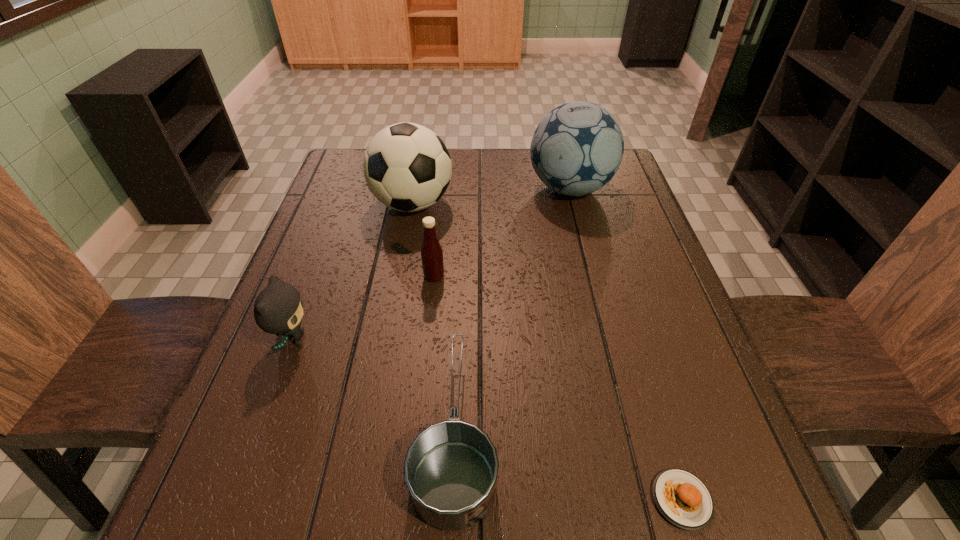
This screenshot has height=540, width=960. I want to click on vacant space at the far right corner of the desktop, so click(618, 185).

At what (x,y) coordinates should I click in order to perform the action: click on free space between the second shortest object and the Tabasco sauce. Please return your answer as a coordinate pair (x, y). Looking at the image, I should click on (444, 353).

The image size is (960, 540). I want to click on free spot between the leftmost object and the saucepan, so click(x=374, y=384).

Locate an element on the screen. The image size is (960, 540). free area in between the right soccer ball and the saucepan is located at coordinates (513, 309).

You are a GUI agent. You are given a task and a screenshot of the screen. Output one action in this format:
    pyautogui.click(x=<x>, y=<y>)
    Task: Click on the unoccupied position between the shortest object and the kitten
    This screenshot has height=540, width=960.
    Given the screenshot: What is the action you would take?
    pyautogui.click(x=488, y=420)

The width and height of the screenshot is (960, 540). I want to click on unoccupied position between the food and the left soccer ball, so click(547, 352).

Find the location of a particular element. This screenshot has height=540, width=960. free spot between the left soccer ball and the saucepan is located at coordinates (434, 317).

This screenshot has width=960, height=540. In order to click on free space between the second shortest object and the Tabasco sauce in this screenshot , I will do `click(444, 353)`.

In order to click on free spot between the Tabasco sauce and the kitten in this screenshot , I will do `click(364, 308)`.

Locate an element on the screen. The width and height of the screenshot is (960, 540). object that is the closest to the left soccer ball is located at coordinates (431, 252).